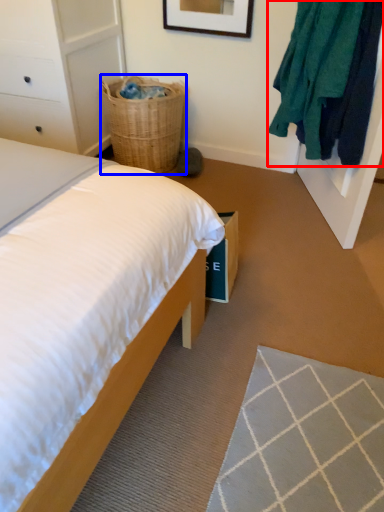
Question: Which point is closer to the camera, clothing (highlighted by a red box) or basket (highlighted by a blue box)?

Choices:
 (A) clothing
 (B) basket

Answer: (A)